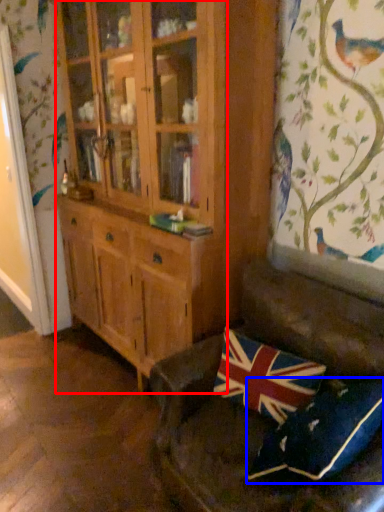
Question: Which object is further to the camera taking this photo, cabinetry (highlighted by a red box) or pillow (highlighted by a blue box)?

Choices:
 (A) cabinetry
 (B) pillow

Answer: (A)